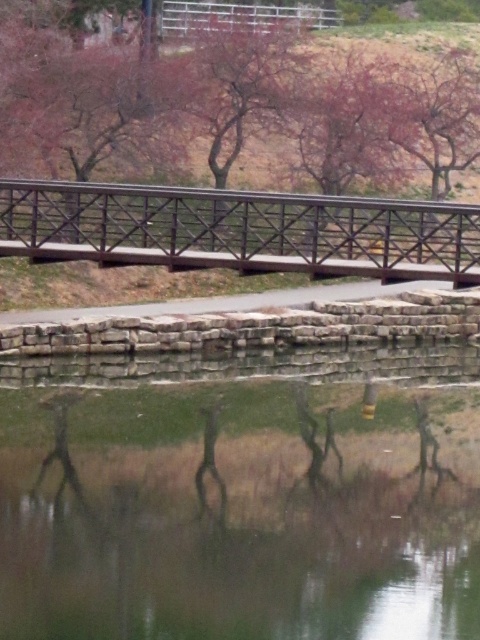
Question: Which object is closer to the camera taking this photo?

Choices:
 (A) smooth pink tree at center
 (B) transparent water at lower center
 (C) black metal bridge at center

Answer: (B)

Question: Where is smooth pink tree at center located in relation to transparent water at lower center in the image?

Choices:
 (A) right
 (B) left

Answer: (A)

Question: Estimate the real-world distances between objects in this image. Which object is closer to the transparent water at lower center?

Choices:
 (A) black metal bridge at center
 (B) smooth pink tree at center

Answer: (A)

Question: Which point is closer to the camera taking this photo?

Choices:
 (A) 14,557
 (B) 476,243
 (C) 36,188

Answer: (A)

Question: Is smooth pink tree at center positioned behind transparent water at lower center?

Choices:
 (A) no
 (B) yes

Answer: (B)

Question: Can you confirm if smooth pink tree at center is positioned to the right of black metal bridge at center?

Choices:
 (A) yes
 (B) no

Answer: (B)